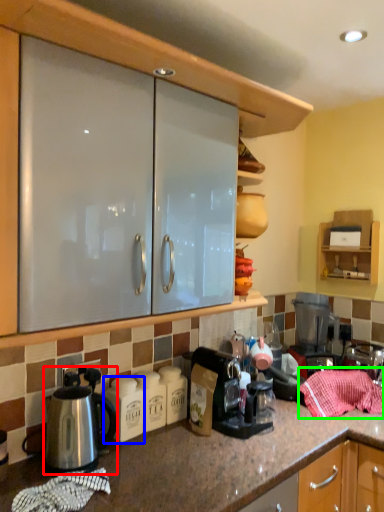
Question: Considering the real-world distances, which object is farthest from kettle (highlighted by a red box)? appliance (highlighted by a blue box) or blanket (highlighted by a green box)?

Choices:
 (A) appliance
 (B) blanket

Answer: (B)